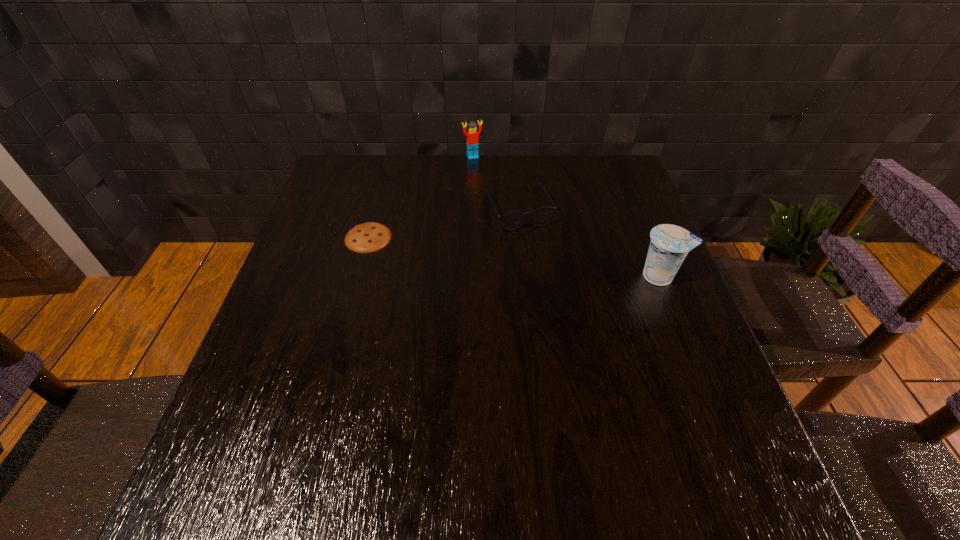
At what (x,y) coordinates should I click in order to perform the action: click on vacant area at the far edge of the desktop. Please return your answer as a coordinate pair (x, y). Looking at the image, I should click on (438, 156).

In the image, there is a desktop. Where is `vacant area at the near edge`? Image resolution: width=960 pixels, height=540 pixels. vacant area at the near edge is located at coordinates (519, 415).

Identify the location of free space at the left edge of the desktop. (324, 312).

In the image, there is a desktop. What are the coordinates of `free space at the right edge` in the screenshot? It's located at (642, 375).

Where is `vacant space at the far left corner of the desktop`? This screenshot has width=960, height=540. vacant space at the far left corner of the desktop is located at coordinates (370, 178).

You are a GUI agent. You are given a task and a screenshot of the screen. Output one action in this format:
    pyautogui.click(x=<x>, y=<y>)
    Task: Click on the free region at the far right corner
    The height and width of the screenshot is (540, 960).
    Given the screenshot: What is the action you would take?
    pyautogui.click(x=590, y=170)

In order to click on empty space between the leftmost object and the second object from left to right in this screenshot , I will do `click(420, 197)`.

This screenshot has height=540, width=960. What are the coordinates of `vacant area that lies between the shortest object and the farthest object` in the screenshot? It's located at (420, 197).

This screenshot has height=540, width=960. Identify the location of free point between the yogurt and the spectacles. (589, 242).

The width and height of the screenshot is (960, 540). Identify the location of empty space that is in between the farthest object and the rightmost object. (566, 217).